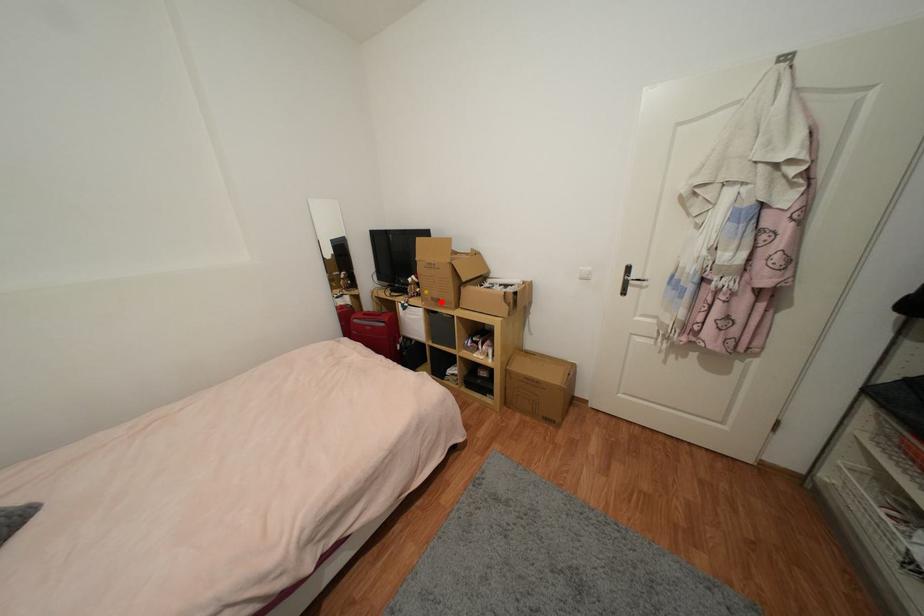
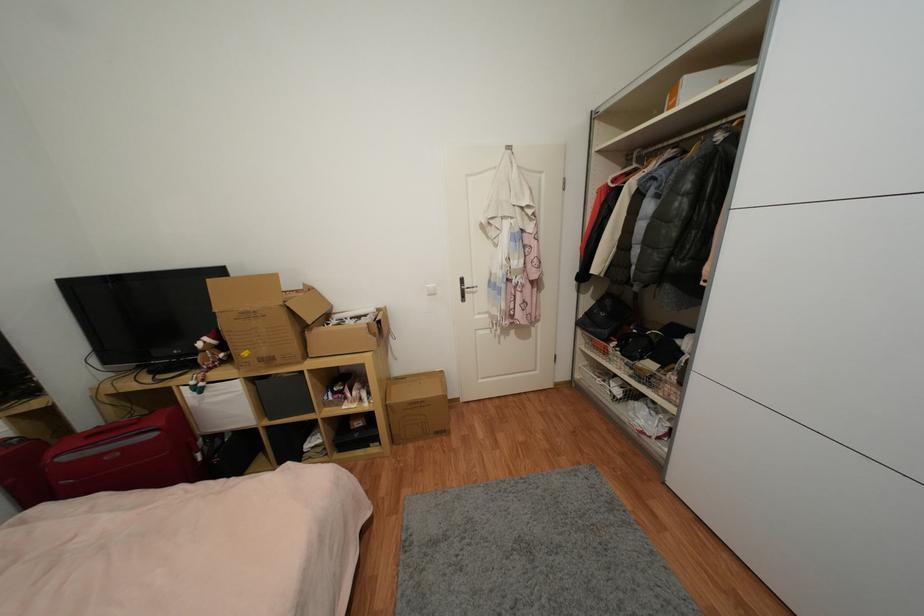
In the second image, find the point that corresponds to the highlighted location in the first image.

(274, 361)